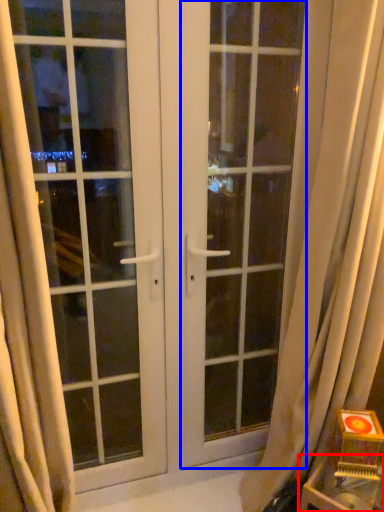
Question: Which object is further to the camera taking this photo, furniture (highlighted by a red box) or screen door (highlighted by a blue box)?

Choices:
 (A) furniture
 (B) screen door

Answer: (B)